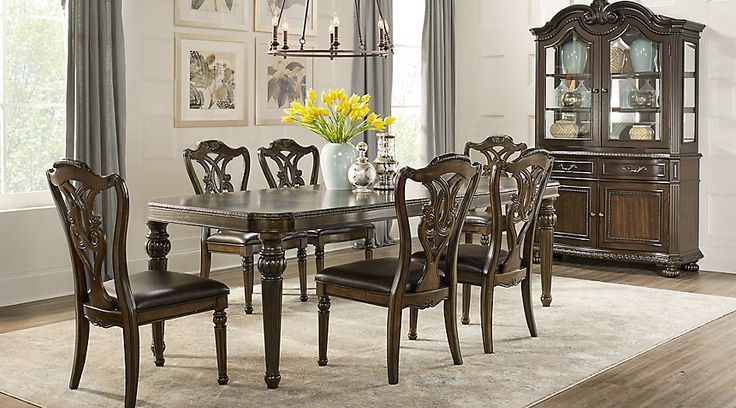
At what (x,y) coordinates should I click in order to perform the action: click on lights. Please return your answer as a coordinate pair (x, y). This screenshot has width=736, height=408. Looking at the image, I should click on (339, 21), (333, 27), (378, 21), (383, 23), (289, 25), (274, 20).